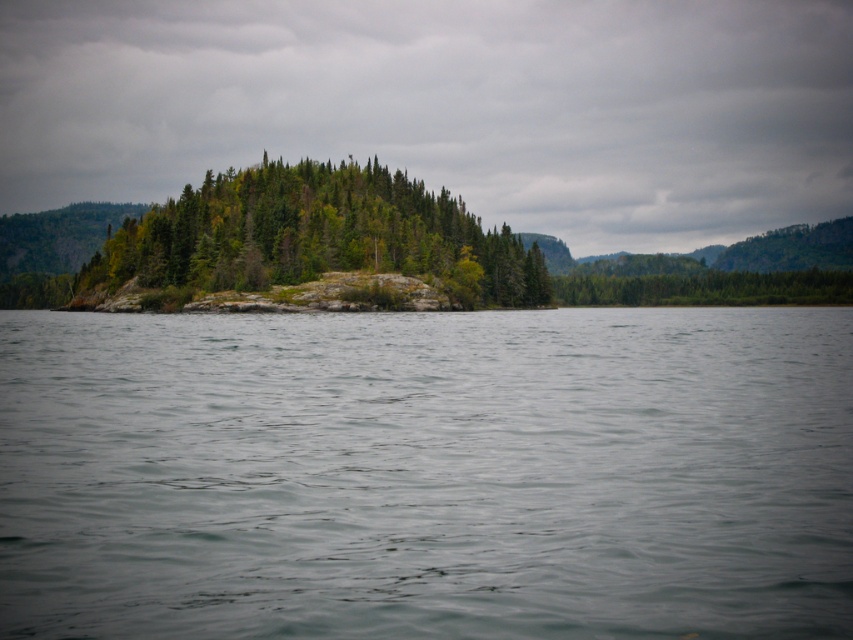
Based on the photo, which is above, gray water at center or green matte forest at center?

Positioned higher is green matte forest at center.

Who is lower down, gray water at center or green matte forest at center?

gray water at center is lower down.

Is point (688, 397) closer to viewer compared to point (265, 189)?

Yes, it is in front of point (265, 189).

Where is `gray water at center`? gray water at center is located at coordinates (427, 474).